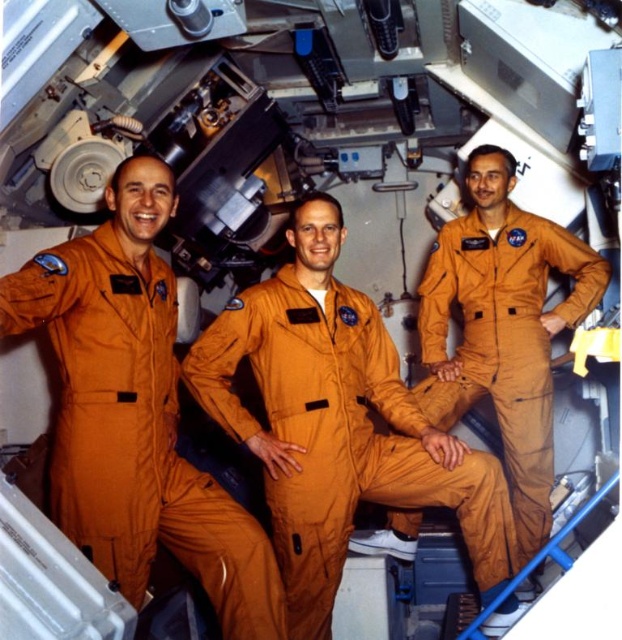
You are an astronaut in the spacecraft and need to identify which orange jumpsuit is on the left. Which one is positioned to the left between the orange smooth jumpsuit at center and the orange fabric jumpsuit at center?

The orange smooth jumpsuit at center is positioned on the left side of the orange fabric jumpsuit at center.

You are an astronaut inside the spacecraft. You need to reach a point that is exactly 2 meters away from your current position. Is the point at coordinates point (x=244, y=573) within your reach?

The point (x=244, y=573) is 1.92 meters away from the viewer, so yes, it is within reach since it is slightly closer than the 2 meters required.